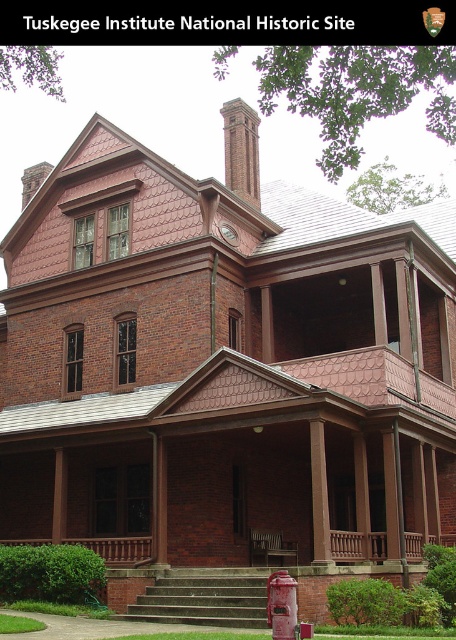
Consider the image. You are standing at the entrance of the Tuskegee Institute National Historic Site and want to take a photo of the building. There is a specific point at coordinates point (336, 536) that you want to focus on. If your camera has a focal length of 50mm and you want to ensure the point is in focus, what is the minimum distance in feet you need to be from the building to achieve this?

The point (336, 536) is 131.41 feet away from the viewer. To ensure the point is in focus with a 50mm focal length, you need to be at least 131.41 feet away from the building.

You are a visitor at the Tuskegee Institute National Historic Site and want to take a photo of both the metallic silver bench at center and the metallic red phone box at lower center. To ensure both objects are fully visible in the frame, which one should you position closer to the camera?

The metallic silver bench at center is taller than the metallic red phone box at lower center, so you should position the metallic silver bench at center closer to the camera to ensure both are fully visible in the frame.

You are standing at the entrance of the Tuskegee Institute National Historic Site and want to locate the brown wood porch at lower center. According to the coordinates provided, where should you look to find it?

The brown wood porch at lower center is located at the coordinates point (357, 547).